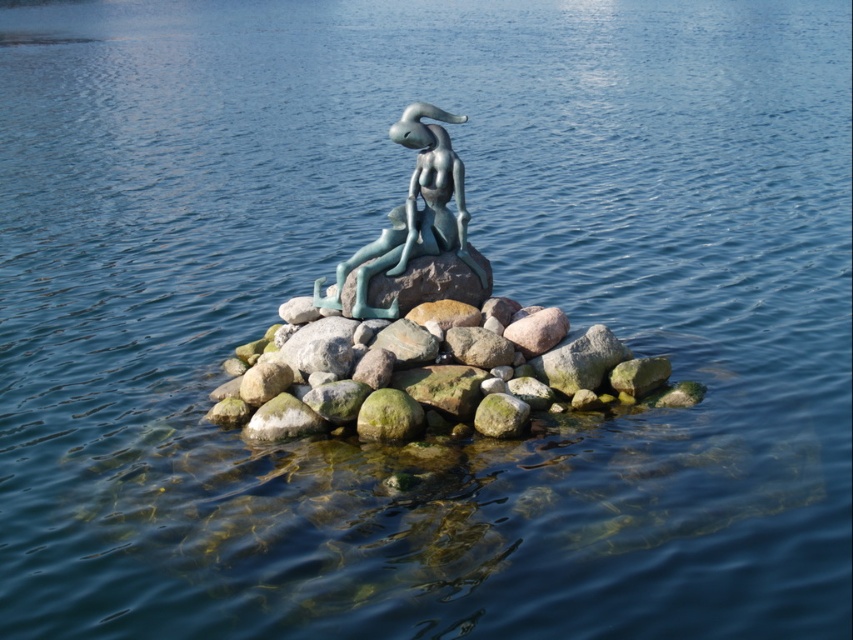
Question: From the image, what is the correct spatial relationship of smooth gray rock at center in relation to green patina statue at center?

Choices:
 (A) left
 (B) right

Answer: (B)

Question: Is smooth gray rock at center closer to the viewer compared to green patina statue at center?

Choices:
 (A) yes
 (B) no

Answer: (A)

Question: Which of the following is the farthest from the observer?

Choices:
 (A) (474, 266)
 (B) (650, 374)

Answer: (A)

Question: Can you confirm if smooth gray rock at center is positioned below green patina statue at center?

Choices:
 (A) no
 (B) yes

Answer: (B)

Question: Which point is farther to the camera?

Choices:
 (A) (292, 364)
 (B) (479, 268)

Answer: (B)

Question: Among these objects, which one is nearest to the camera?

Choices:
 (A) green patina statue at center
 (B) smooth gray rock at center

Answer: (B)